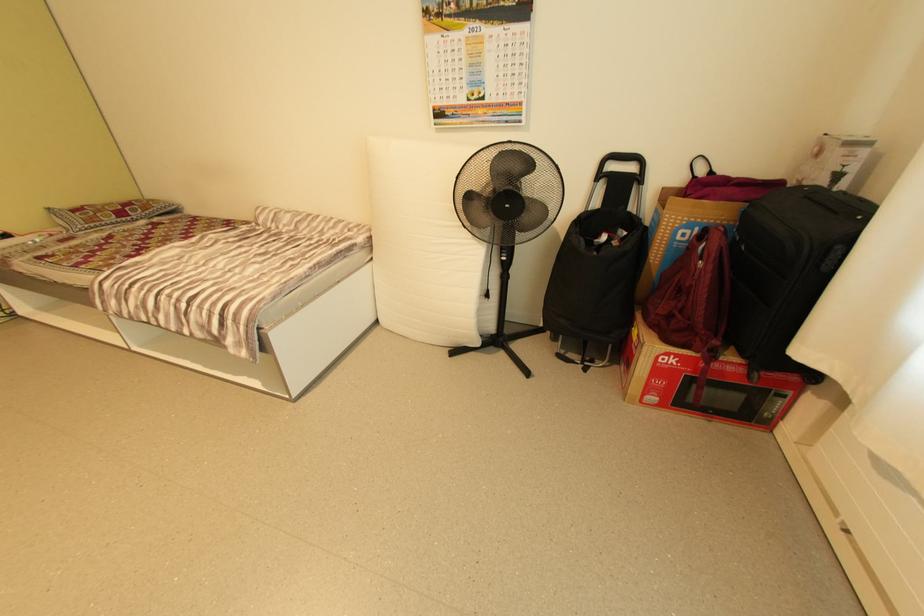
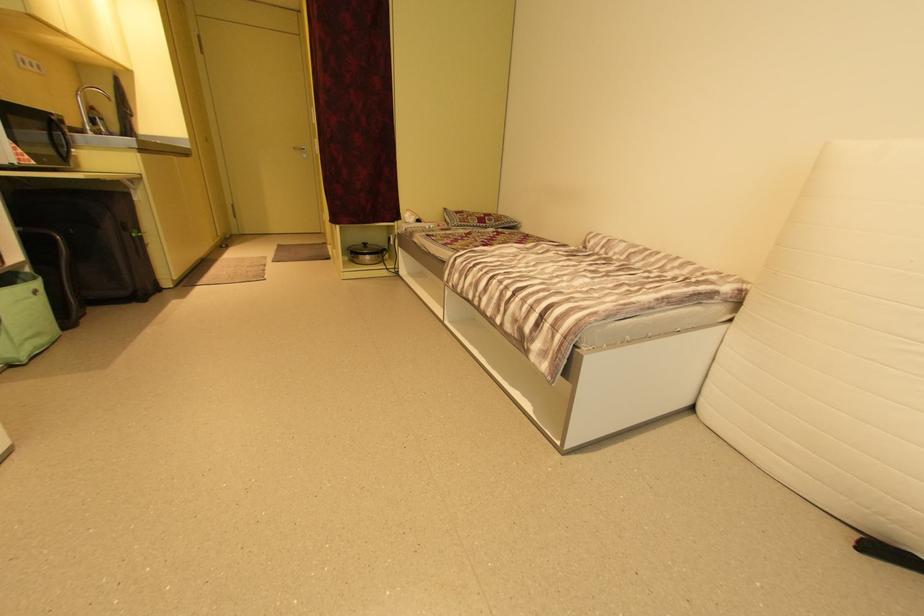
Question: The camera is either moving clockwise (left) or counter-clockwise (right) around the object. The first image is from the beginning of the video and the second image is from the end. Is the camera moving left or right when shooting the video?

Choices:
 (A) Left
 (B) Right

Answer: (B)